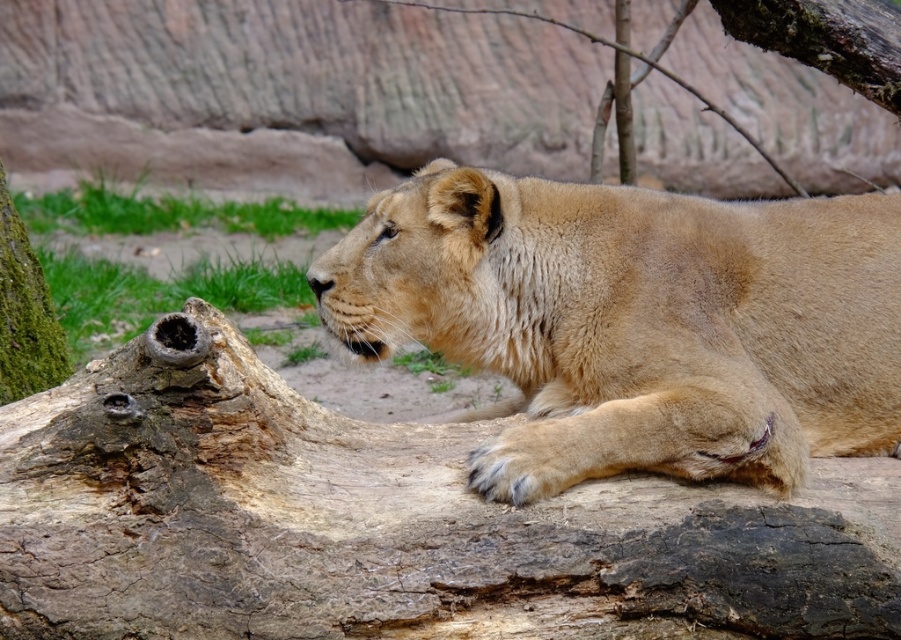
Is brown rough tree trunk at center taller than fuzzy golden lion at center?

No, brown rough tree trunk at center is not taller than fuzzy golden lion at center.

Between point (497, 520) and point (779, 204), which one is positioned behind?

Positioned behind is point (779, 204).

You are a GUI agent. You are given a task and a screenshot of the screen. Output one action in this format:
    pyautogui.click(x=<x>, y=<y>)
    Task: Click on the brown rough tree trunk at center
    The height and width of the screenshot is (640, 901).
    Given the screenshot: What is the action you would take?
    pyautogui.click(x=389, y=524)